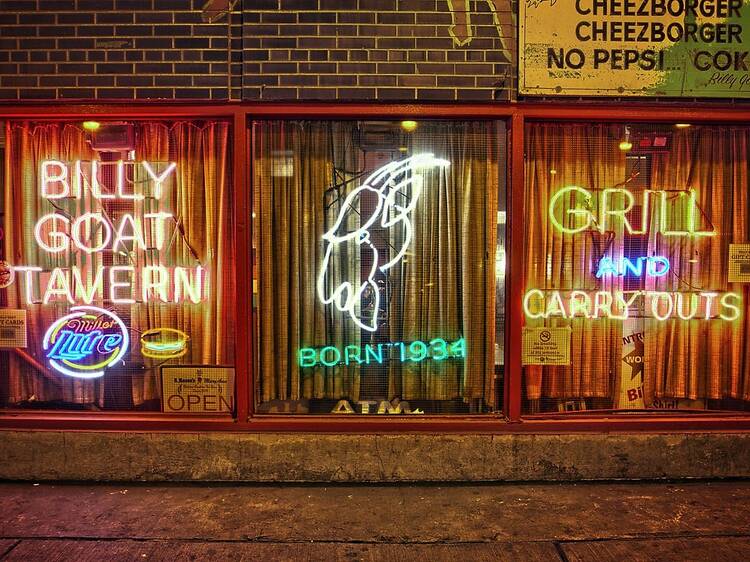
The height and width of the screenshot is (562, 750). Find the location of `window`. window is located at coordinates (316, 355).